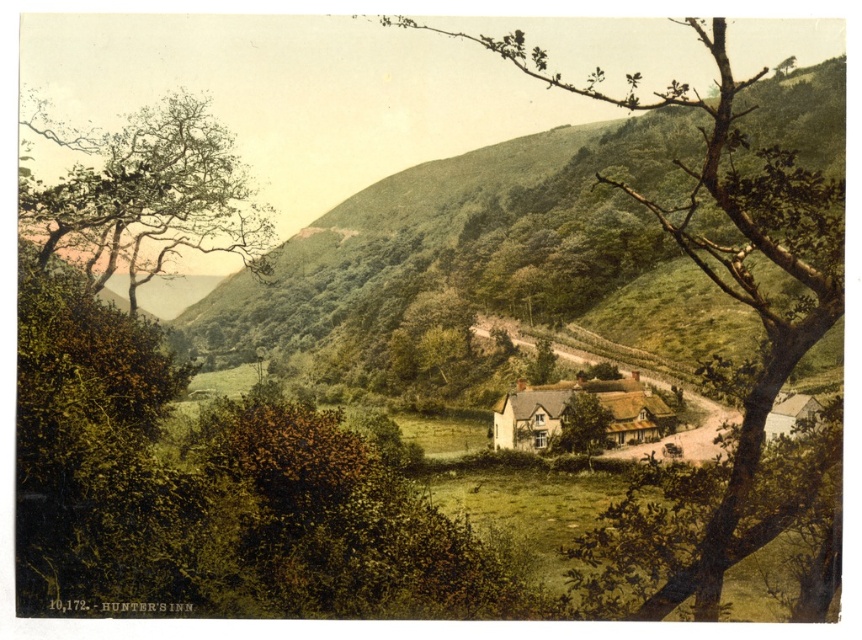
You are a hiker standing at the starting point of the trail. You see the green leafy hillside at center and the green leafy tree at center. Which one is more to the left?

The green leafy hillside at center is positioned on the left side of green leafy tree at center, so the green leafy hillside at center is more to the left.

You are standing at the edge of the road and see both the green leafy hillside at center and the green leafy tree at center. Which one is closer to you?

The green leafy hillside at center is closer to you because the green leafy tree at center is behind it.